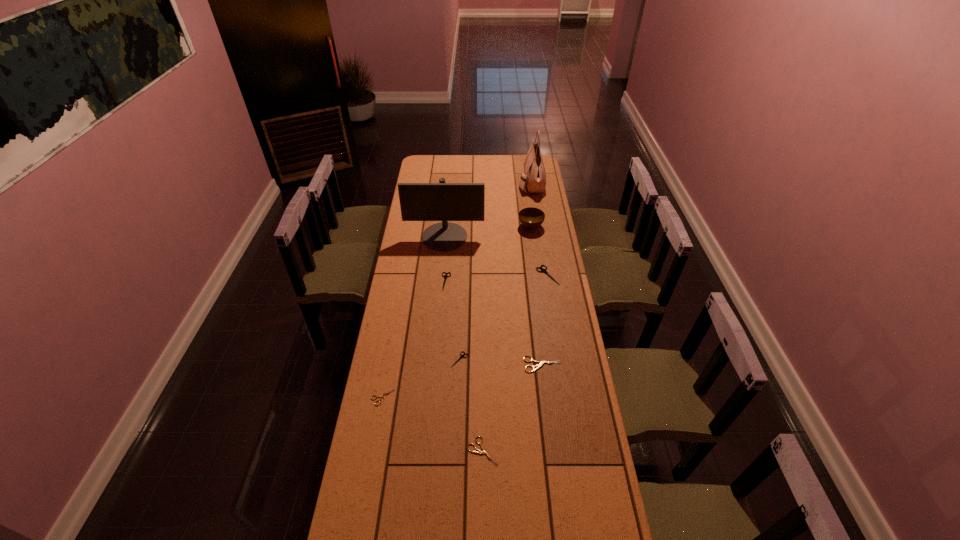
The width and height of the screenshot is (960, 540). I want to click on handbag, so click(534, 177).

Locate an element on the screen. computer monitor is located at coordinates (441, 201).

Image resolution: width=960 pixels, height=540 pixels. Find the location of `bowl`. bowl is located at coordinates (531, 218).

Identify the location of the sixth shortest object. The image size is (960, 540). (542, 270).

Image resolution: width=960 pixels, height=540 pixels. Find the location of `the biggest black shears`. the biggest black shears is located at coordinates (542, 270).

I want to click on the leftmost black shears, so click(445, 276).

I want to click on the fifth shears from right to left, so click(445, 276).

At what (x,y) coordinates should I click in order to perform the action: click on the farthest beige shears. Please return your answer as a coordinate pair (x, y). The height and width of the screenshot is (540, 960). Looking at the image, I should click on (541, 363).

Find the location of a particular element. the biggest beige shears is located at coordinates (541, 363).

Where is `the nearest beige shears`? the nearest beige shears is located at coordinates (483, 451).